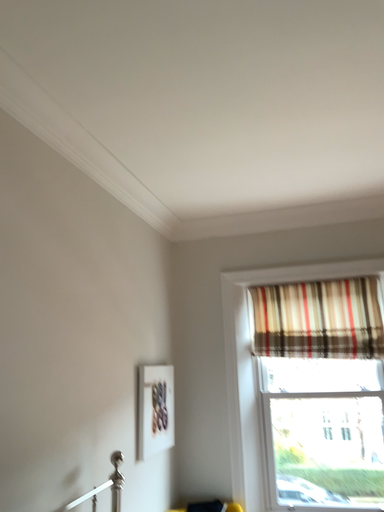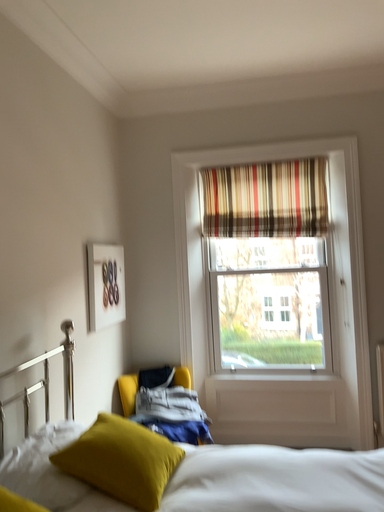
Question: Which way did the camera rotate in the video?

Choices:
 (A) rotated right
 (B) rotated left

Answer: (A)